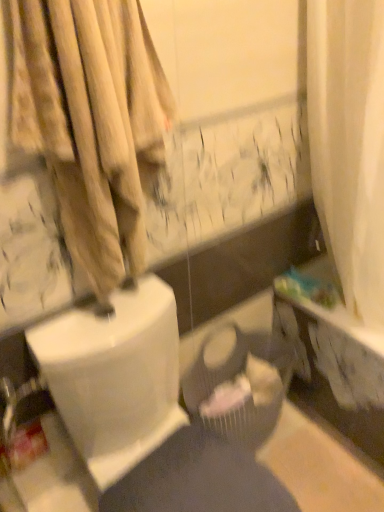
The width and height of the screenshot is (384, 512). I want to click on beige textured curtain at left, so click(x=91, y=122).

What do you see at coordinates (91, 122) in the screenshot? Image resolution: width=384 pixels, height=512 pixels. I see `beige textured curtain at left` at bounding box center [91, 122].

What is the approximate height of beige textured curtain at left?

The height of beige textured curtain at left is 23.49 inches.

You are a GUI agent. You are given a task and a screenshot of the screen. Output one action in this format:
    pyautogui.click(x=<x>, y=<y>)
    Task: Click on the beige textured curtain at left
    Image resolution: width=384 pixels, height=512 pixels.
    Given the screenshot: What is the action you would take?
    (x=91, y=122)